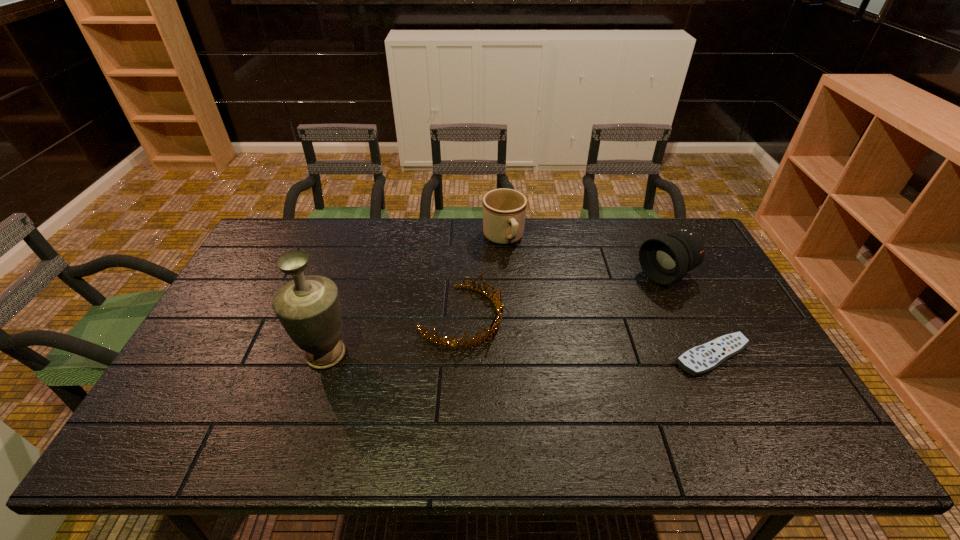
Find the location of a particular element. The width and height of the screenshot is (960, 540). urn is located at coordinates (308, 307).

Find the location of a particular element. Image resolution: width=960 pixels, height=540 pixels. the leftmost object is located at coordinates (308, 307).

In order to click on remote control in this screenshot , I will do (x=699, y=360).

This screenshot has height=540, width=960. Identify the location of mug. (504, 210).

Find the location of `telephoto lens`. telephoto lens is located at coordinates (665, 258).

I want to click on the fourth tallest object, so click(x=474, y=341).

This screenshot has width=960, height=540. I want to click on blank space located 0.120m on the back of the leftmost object, so click(x=343, y=303).

Identify the location of vacant space located on the left of the remote control. The image size is (960, 540). (567, 356).

The image size is (960, 540). What are the coordinates of `free region located on the side of the farthest object with the handle` in the screenshot? It's located at (539, 316).

Identify the location of vacant space located 0.200m on the side of the farthest object with the handle. (528, 295).